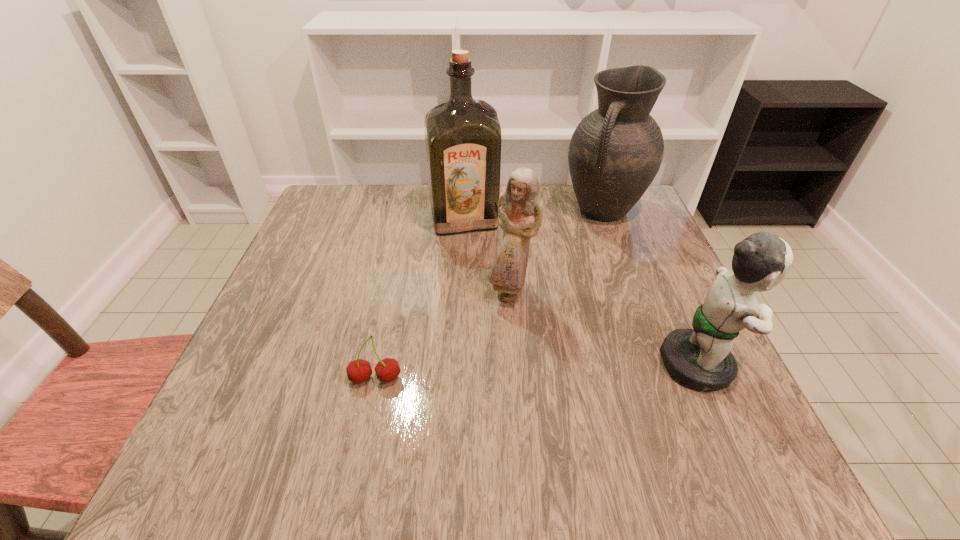
Image resolution: width=960 pixels, height=540 pixels. In the image, there is a desktop. Find the location of `vacant region at the near right corner`. vacant region at the near right corner is located at coordinates (734, 411).

At what (x,y) coordinates should I click in order to perform the action: click on vacant region between the pitcher and the left figurine. Please return your answer as a coordinate pair (x, y). Image resolution: width=960 pixels, height=540 pixels. Looking at the image, I should click on pyautogui.click(x=557, y=252).

This screenshot has width=960, height=540. Identify the location of free spot between the shortest object and the farther figurine. (444, 336).

Where is `vacant space that's between the left figurine and the leftmost object`? vacant space that's between the left figurine and the leftmost object is located at coordinates (444, 336).

Identify the location of unoccupied area between the leftmost object and the right figurine. tap(539, 372).

Find the location of a particular element. The width and height of the screenshot is (960, 540). vacant space that is in between the nearer figurine and the cherry is located at coordinates (539, 372).

The height and width of the screenshot is (540, 960). Identify the location of vacant space that's between the right figurine and the second tallest object. (652, 287).

Where is `vacant area between the leftmost object and the nearer figurine`? vacant area between the leftmost object and the nearer figurine is located at coordinates (539, 372).

This screenshot has height=540, width=960. In order to click on free space that is in between the third farthest object and the right figurine in this screenshot , I will do `click(606, 328)`.

The height and width of the screenshot is (540, 960). Identify the location of vacant space that is in between the cherry and the nearer figurine. (539, 372).